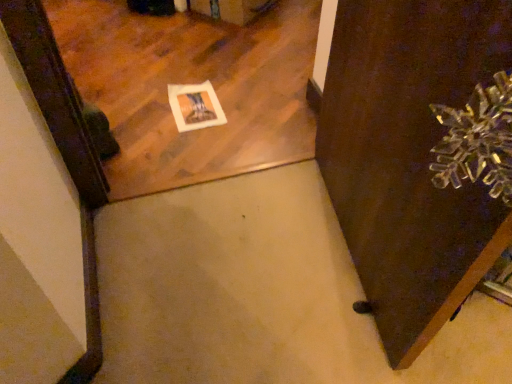
Question: From a real-world perspective, relative to matte wooden mirror at upper left, is brown wooden door at right vertically above or below?

Choices:
 (A) above
 (B) below

Answer: (A)

Question: In terms of height, does brown wooden door at right look taller or shorter compared to matte wooden mirror at upper left?

Choices:
 (A) short
 (B) tall

Answer: (B)

Question: Is brown wooden door at right wider or thinner than matte wooden mirror at upper left?

Choices:
 (A) thin
 (B) wide

Answer: (A)

Question: Looking at the image, does matte wooden mirror at upper left seem bigger or smaller compared to brown wooden door at right?

Choices:
 (A) small
 (B) big

Answer: (A)

Question: Which is correct: matte wooden mirror at upper left is inside brown wooden door at right, or outside of it?

Choices:
 (A) outside
 (B) inside

Answer: (A)

Question: From the image's perspective, is matte wooden mirror at upper left located above or below brown wooden door at right?

Choices:
 (A) above
 (B) below

Answer: (A)

Question: Looking at their shapes, would you say matte wooden mirror at upper left is wider or thinner than brown wooden door at right?

Choices:
 (A) wide
 (B) thin

Answer: (A)